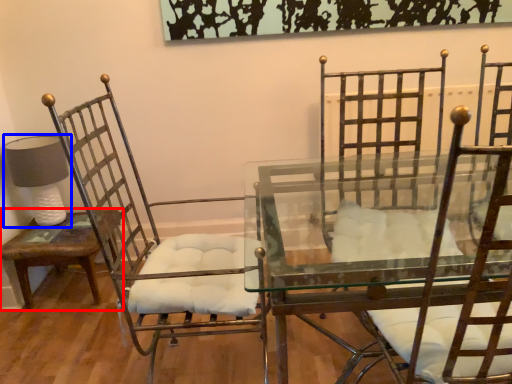
Question: Which object is further to the camera taking this photo, table (highlighted by a red box) or table lamp (highlighted by a blue box)?

Choices:
 (A) table
 (B) table lamp

Answer: (B)